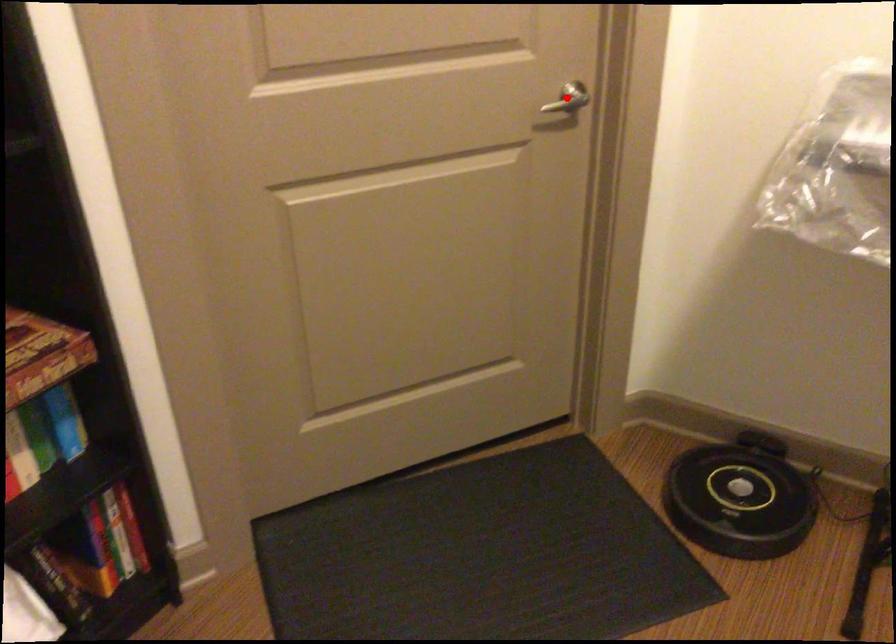
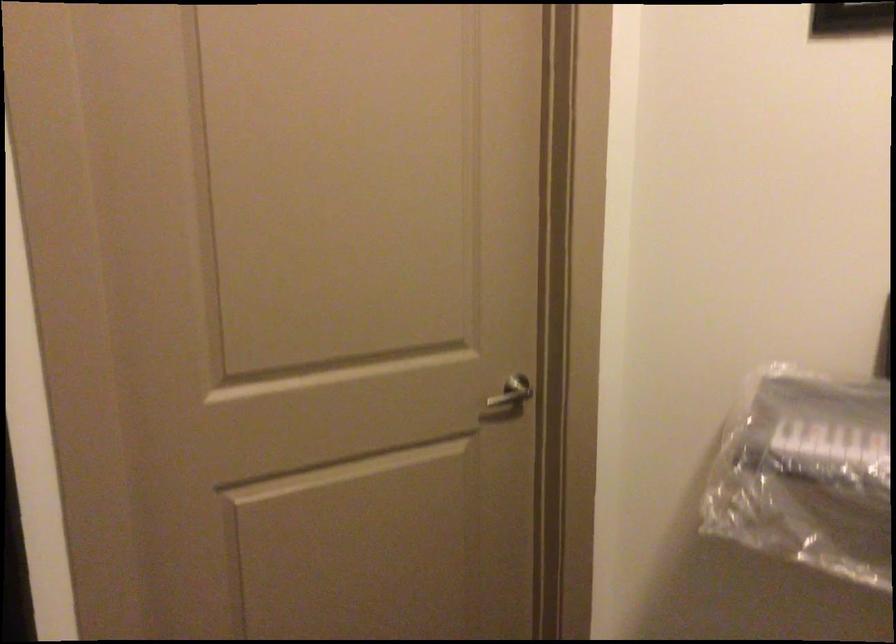
The point at the highlighted location is marked in the first image. Where is the corresponding point in the second image?

(512, 392)